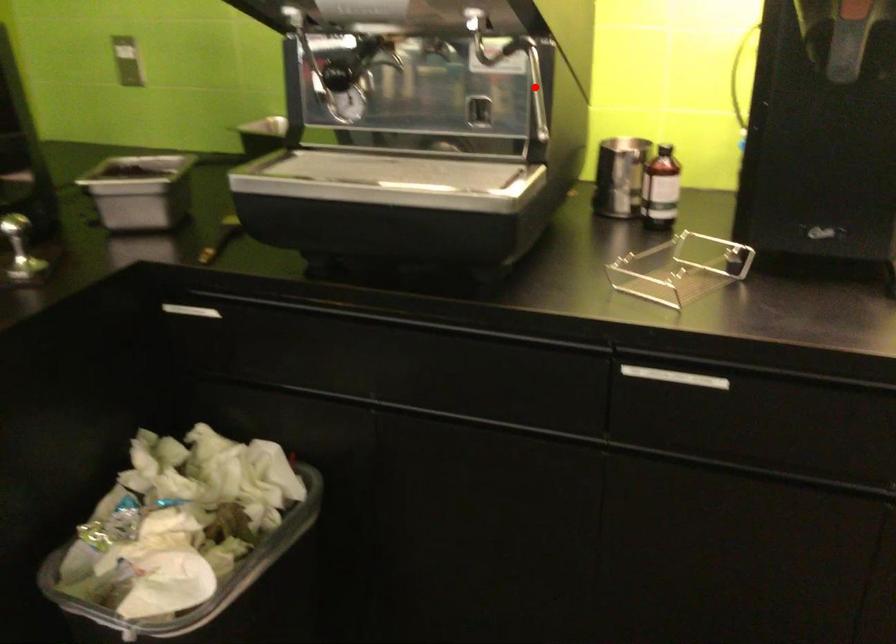
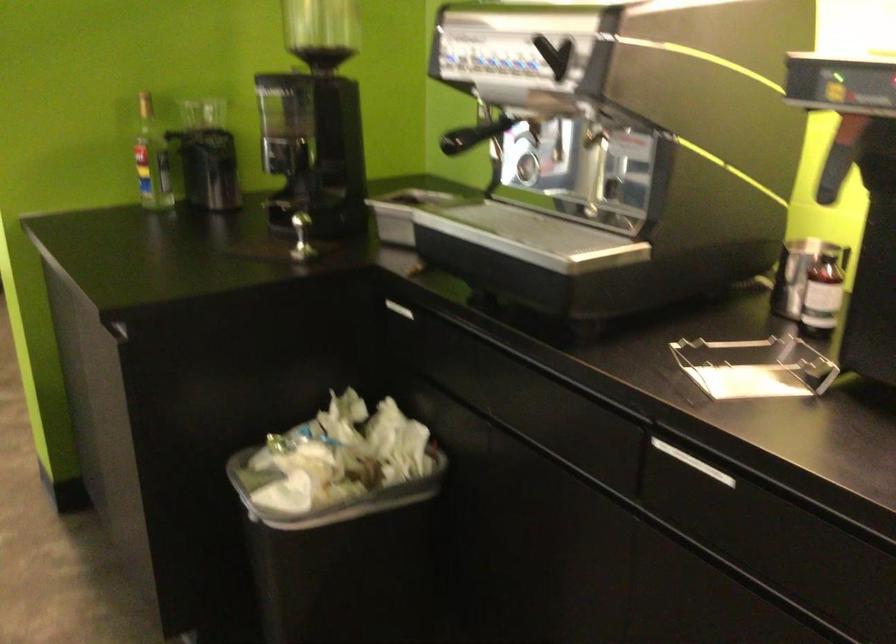
Question: I am providing you with two images of the same scene from different viewpoints. A red point is shown in image1. For the corresponding object point in image2, is it positioned nearer or farther from the camera?

Choices:
 (A) Nearer
 (B) Farther

Answer: (B)